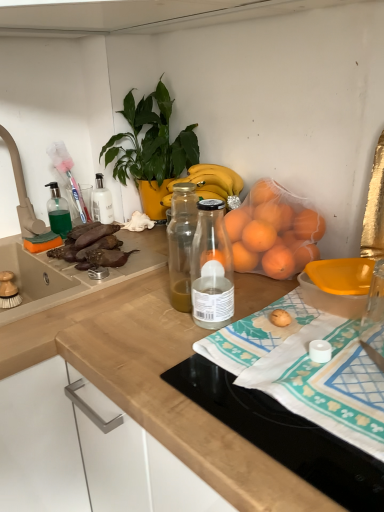
Identify the location of free spot above yellow plastic bowl at lower right (from a real-world perspective). (352, 270).